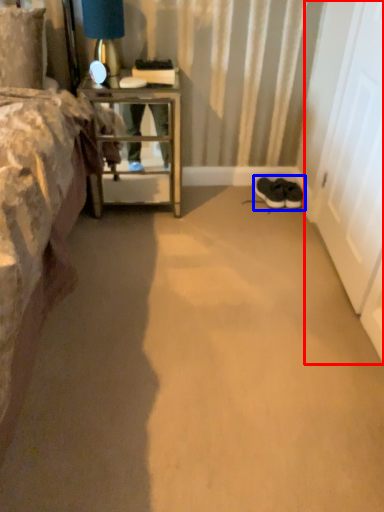
Question: Which point is further to the camera, screen door (highlighted by a red box) or footwear (highlighted by a blue box)?

Choices:
 (A) screen door
 (B) footwear

Answer: (B)